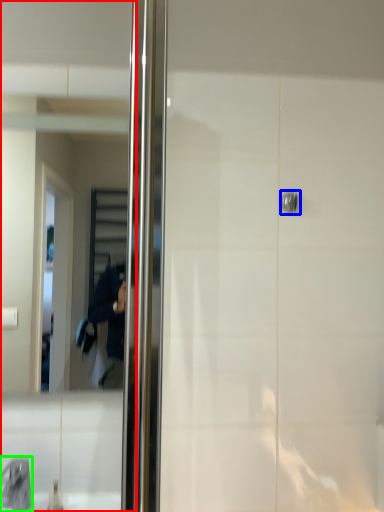
Question: Based on their relative distances, which object is farther from mirror (highlighted by a red box)? Choose from door handle (highlighted by a blue box) and faucet (highlighted by a green box).

Choices:
 (A) door handle
 (B) faucet

Answer: (A)